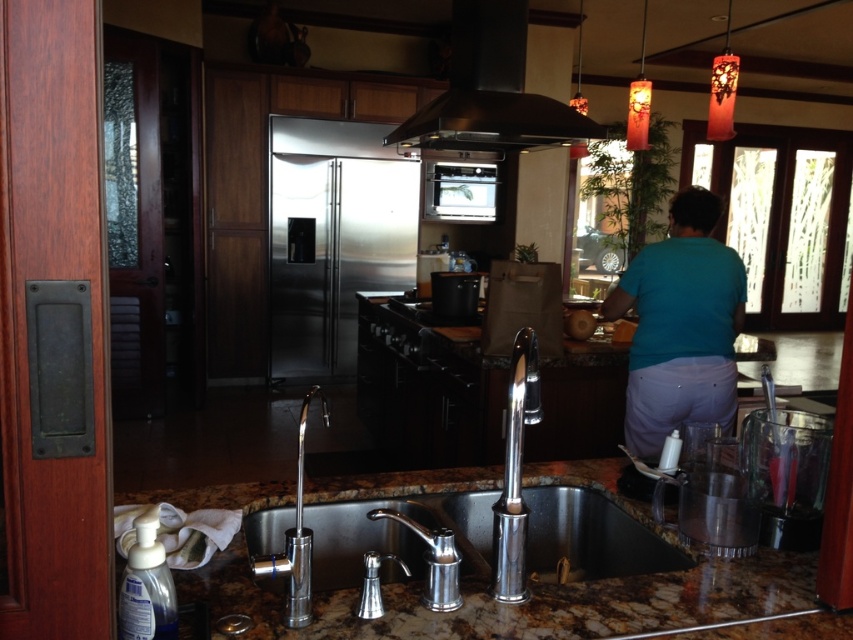
Who is lower down, black matte exhaust hood at upper center or satin stainless steel oven at center?

black matte exhaust hood at upper center is below.

Between point (491, 147) and point (456, 204), which one is positioned behind?

The point (456, 204) is behind.

At what (x,y) coordinates should I click in order to perform the action: click on black matte exhaust hood at upper center. Please return your answer as a coordinate pair (x, y). Looking at the image, I should click on (491, 92).

Is stainless steel refrigerator at center wider than chrome/metallic faucet at sink left?

Yes, stainless steel refrigerator at center is wider than chrome/metallic faucet at sink left.

Which is in front, point (338, 360) or point (299, 536)?

Point (299, 536) is in front.

Describe the element at coordinates (334, 237) in the screenshot. The image size is (853, 640). I see `stainless steel refrigerator at center` at that location.

This screenshot has height=640, width=853. In order to click on stainless steel refrigerator at center in this screenshot , I will do `click(334, 237)`.

Which of these two, clear plastic blender at lower right or polished chrome faucet at sink center, stands taller?

polished chrome faucet at sink center

Between point (793, 472) and point (514, 356), which one is positioned behind?

The point (793, 472) is behind.

I want to click on clear plastic blender at lower right, so click(786, 474).